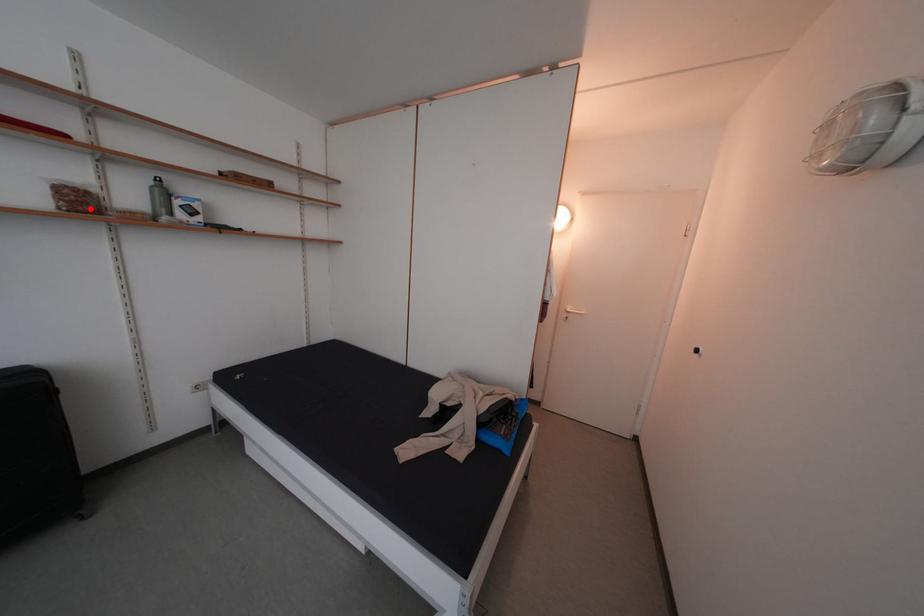
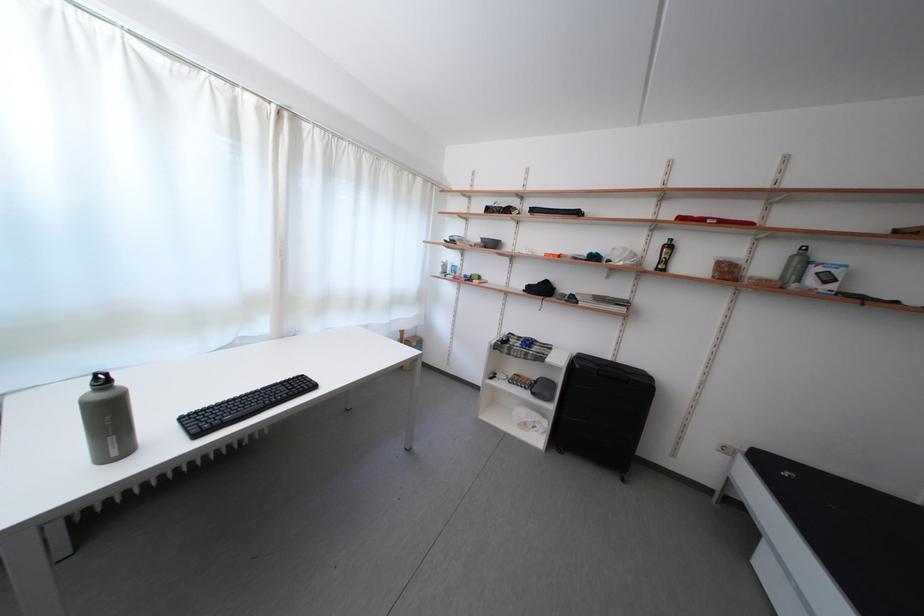
Question: I am providing you with two images of the same scene from different viewpoints. A red point is marked on the first image. Is the red point's position out of view in image 2?

Choices:
 (A) Yes
 (B) No

Answer: (B)